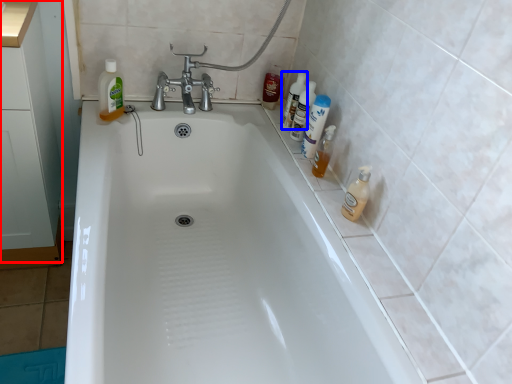
Question: Which object appears closest to the camera in this image, cabinetry (highlighted by a red box) or cleaning product (highlighted by a blue box)?

Choices:
 (A) cabinetry
 (B) cleaning product

Answer: (A)